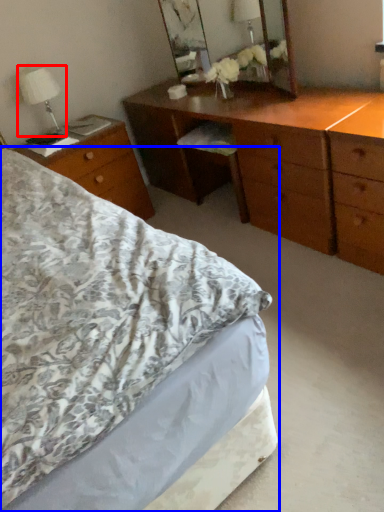
Question: Which point is further to the camera, bedside lamp (highlighted by a red box) or bed (highlighted by a blue box)?

Choices:
 (A) bedside lamp
 (B) bed

Answer: (A)